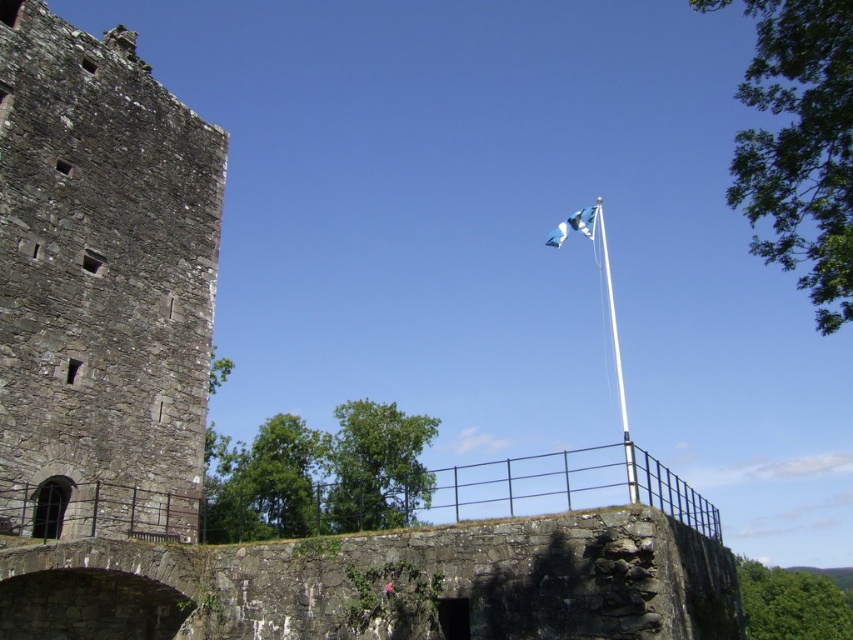
Question: Is white metallic flag pole at upper right positioned at the back of blue fabric flag at upper center?

Choices:
 (A) yes
 (B) no

Answer: (B)

Question: Estimate the real-world distances between objects in this image. Which object is closer to the blue fabric flag at upper center?

Choices:
 (A) rough stone tower at left
 (B) white metallic flag pole at upper right

Answer: (B)

Question: Can you confirm if rough stone tower at left is positioned to the right of white metallic flag pole at upper right?

Choices:
 (A) yes
 (B) no

Answer: (B)

Question: Which object is closer to the camera taking this photo?

Choices:
 (A) rough stone tower at left
 (B) white metallic flag pole at upper right

Answer: (B)

Question: Estimate the real-world distances between objects in this image. Which object is farther from the rough stone tower at left?

Choices:
 (A) blue fabric flag at upper center
 (B) white metallic flag pole at upper right

Answer: (B)

Question: Considering the relative positions of white metallic flag pole at upper right and blue fabric flag at upper center in the image provided, where is white metallic flag pole at upper right located with respect to blue fabric flag at upper center?

Choices:
 (A) left
 (B) right

Answer: (B)